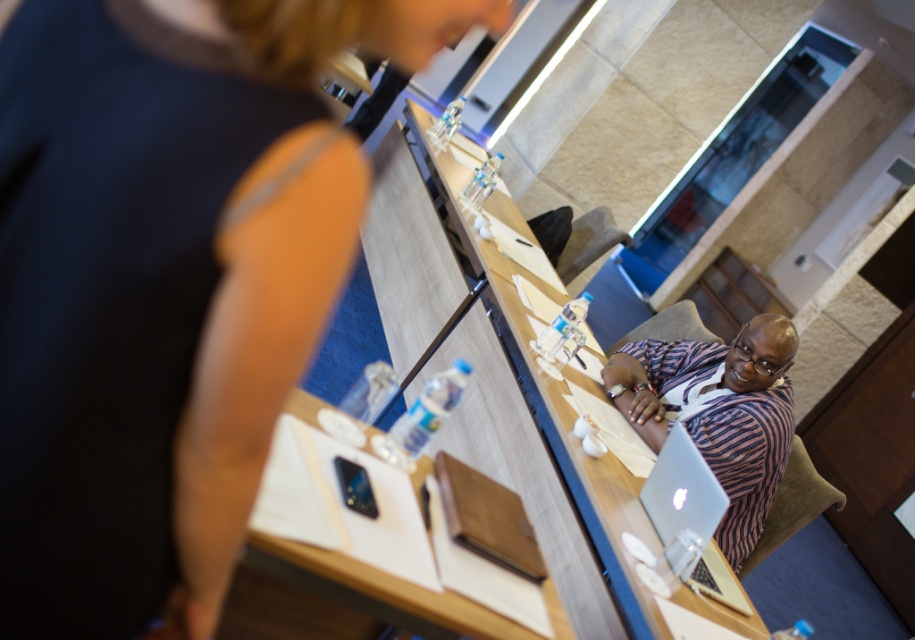
You are standing at the entrance of the conference room and see the point marked at coordinates (165, 280). Which object from the scene is this point most likely located on?

The point marked at coordinates (165, 280) is located on the matte black shirt at upper left.

From the picture: You are standing at the entrance of the conference room and want to locate the striped fabric shirt at center. According to the coordinates provided, where should you look relative to the room?

The striped fabric shirt at center is located at coordinates point 0.645 on the x axis and 0.786 on the y axis, so you should look towards the right side of the room and slightly forward from the entrance.

You are a photographer setting up for a group photo in the conference room. You need to ensure that the matte black shirt at upper left and the silver metallic laptop at center are both visible in the frame. Based on their positions, which object should be placed closer to the left edge of the photo to maintain their natural arrangement?

The matte black shirt at upper left should be placed closer to the left edge of the photo because it is positioned on the left side of the silver metallic laptop at center.